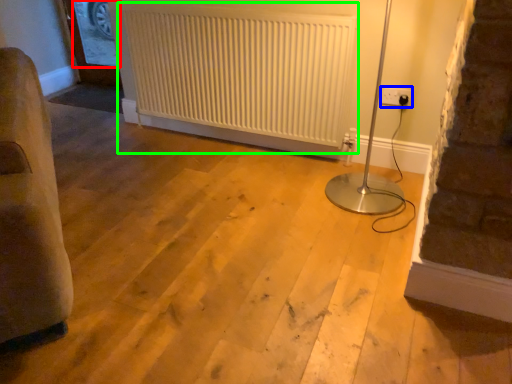
Question: Which object is the farthest from window screen (highlighted by a red box)? Choose among these: electric outlet (highlighted by a blue box) or radiator (highlighted by a green box).

Choices:
 (A) electric outlet
 (B) radiator

Answer: (A)